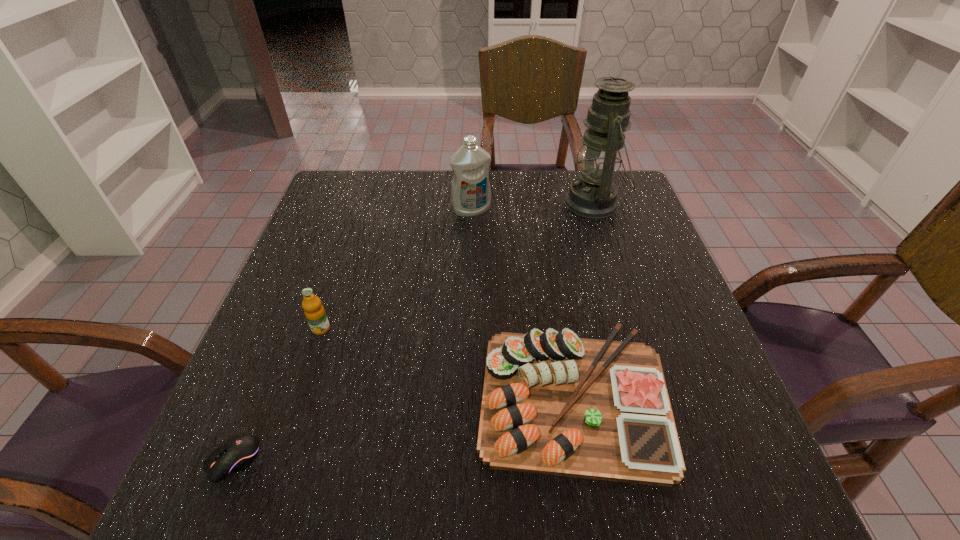
I want to click on free spot between the second shortest object and the oil lamp, so click(584, 300).

Where is `free space between the tallest object and the computer mouse`? This screenshot has height=540, width=960. free space between the tallest object and the computer mouse is located at coordinates (414, 332).

Where is `unoccupied area between the third shortest object and the fourth tallest object`? This screenshot has width=960, height=540. unoccupied area between the third shortest object and the fourth tallest object is located at coordinates (447, 363).

Where is `free space between the oil lamp and the fourth tallest object`? The image size is (960, 540). free space between the oil lamp and the fourth tallest object is located at coordinates (584, 300).

At what (x,y) coordinates should I click in order to perform the action: click on free space between the fourth tallest object and the second object from left to right. Please return your answer as a coordinate pair (x, y). The image size is (960, 540). Looking at the image, I should click on (447, 363).

The image size is (960, 540). I want to click on free spot between the detergent and the fourth tallest object, so click(x=522, y=303).

In order to click on unoccupied area between the computer mouse and the platter in this screenshot , I will do `click(403, 429)`.

Identify the location of the fourth closest object to the tallest object. (234, 455).

Where is `object identified as the closest to the second object from left to right`? object identified as the closest to the second object from left to right is located at coordinates (234, 455).

Where is `vacant space that satisfies the following two spatial constraints: 1. on the back side of the second shortest object; 2. on the right side of the leftmost object`? vacant space that satisfies the following two spatial constraints: 1. on the back side of the second shortest object; 2. on the right side of the leftmost object is located at coordinates (258, 397).